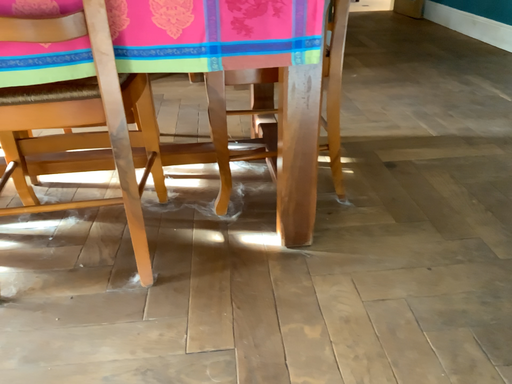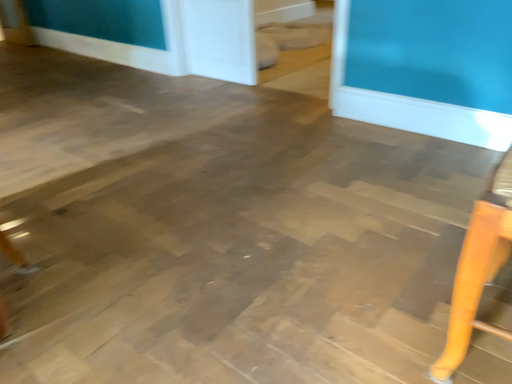
Question: Which way did the camera rotate in the video?

Choices:
 (A) rotated left
 (B) rotated right

Answer: (B)